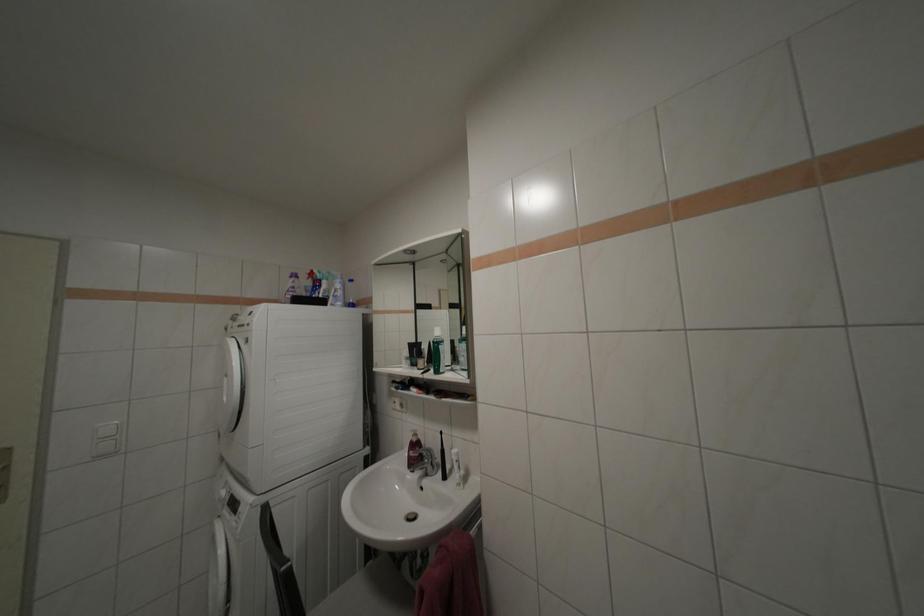
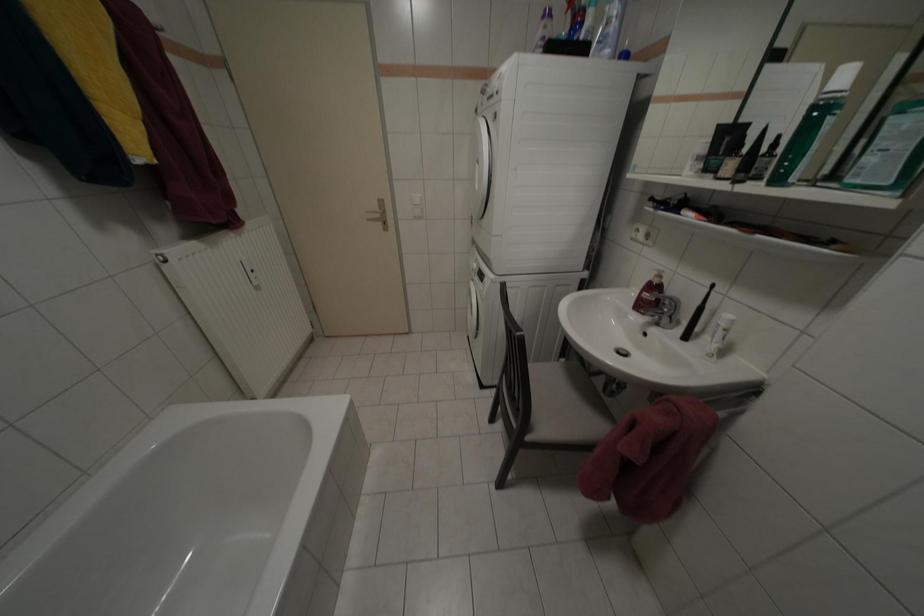
Based on the photo, the first image is from the beginning of the video and the second image is from the end. How did the camera likely rotate when shooting the video?

The camera's rotation is toward left-down.